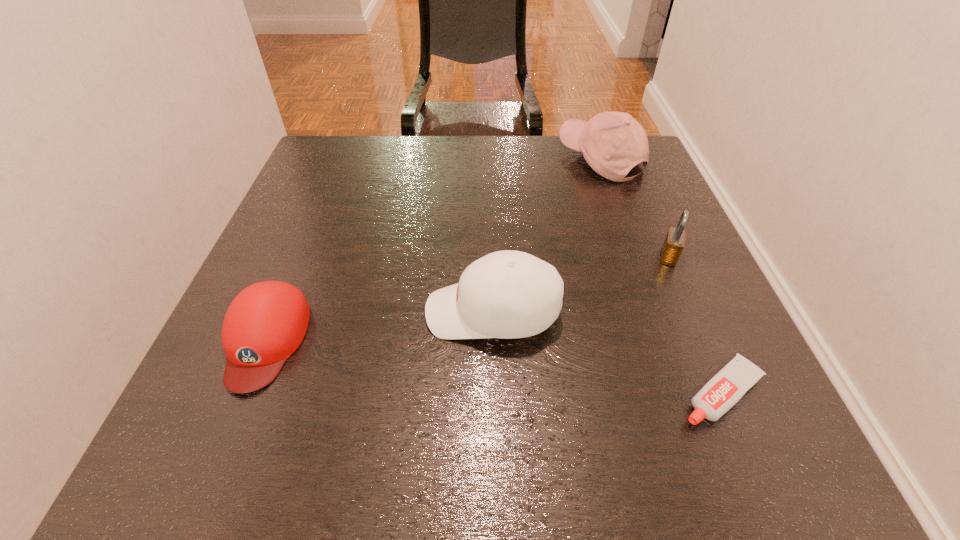
In the image, there is a desktop. Where is `free space at the near right corner`? free space at the near right corner is located at coordinates (764, 424).

The image size is (960, 540). I want to click on empty space that is in between the rightmost baseball cap and the padlock, so click(x=635, y=207).

Identify the location of vacant point located between the farthest baseball cap and the toothpaste. (660, 275).

Where is `free spot between the toothpaste and the fourth tallest object`? This screenshot has width=960, height=540. free spot between the toothpaste and the fourth tallest object is located at coordinates (493, 366).

You are a GUI agent. You are given a task and a screenshot of the screen. Output one action in this format:
    pyautogui.click(x=<x>, y=<y>)
    Task: Click on the vacant space in between the padlock and the farthest baseball cap
    The height and width of the screenshot is (540, 960).
    Given the screenshot: What is the action you would take?
    pyautogui.click(x=635, y=207)

This screenshot has width=960, height=540. In order to click on empty space that is in between the farthest baseball cap and the fourth nearest object in this screenshot , I will do `click(635, 207)`.

This screenshot has width=960, height=540. I want to click on vacant space that is in between the second shortest object and the shortest object, so click(x=493, y=366).

The width and height of the screenshot is (960, 540). In order to click on free space that is in between the farthest baseball cap and the second farthest object in this screenshot , I will do `click(635, 207)`.

Locate an element on the screen. This screenshot has width=960, height=540. empty location between the farthest object and the toothpaste is located at coordinates (660, 275).

The width and height of the screenshot is (960, 540). In order to click on empty location between the rightmost baseball cap and the second shortest object in this screenshot , I will do `click(433, 249)`.